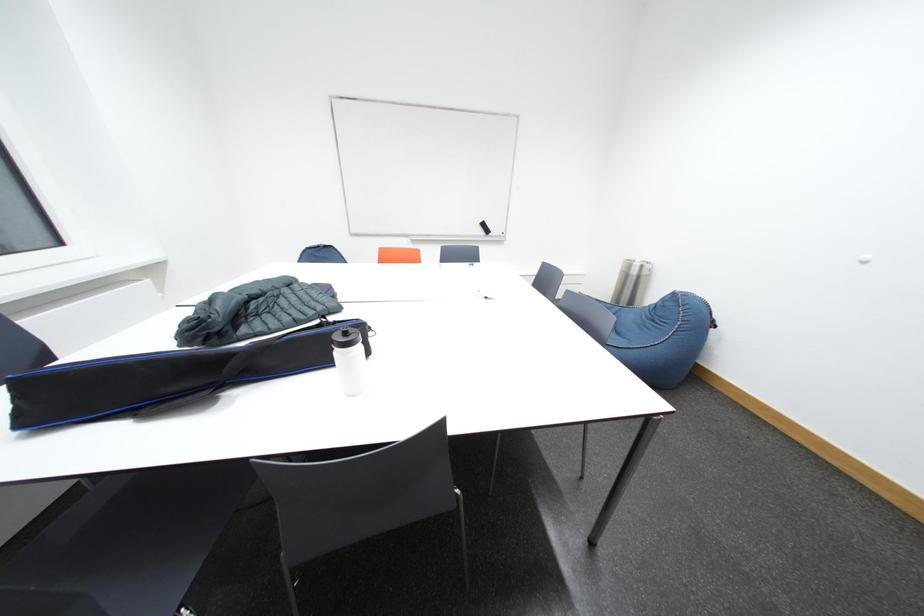
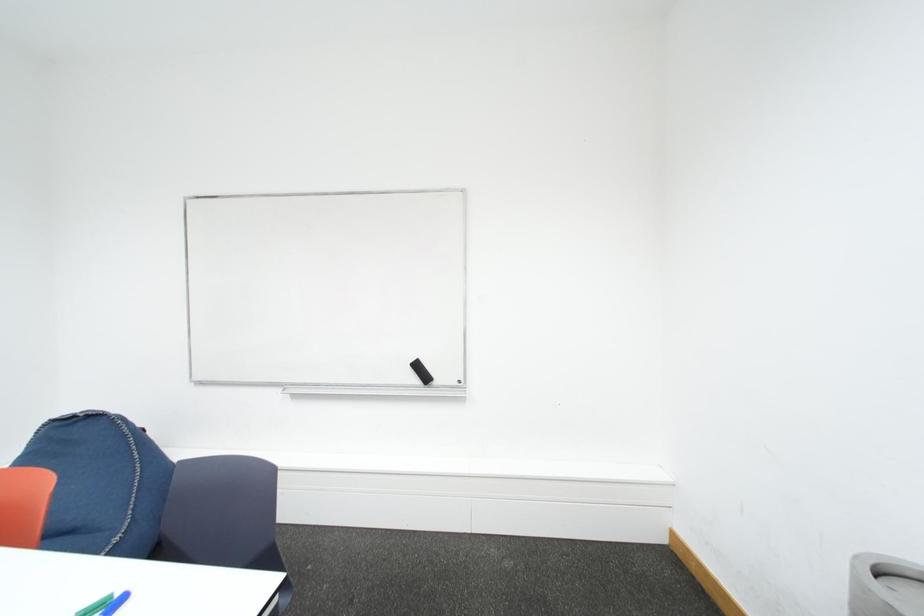
The images are taken continuously from a first-person perspective. In which direction are you moving?

The movement direction of the cameraman is right, forward.